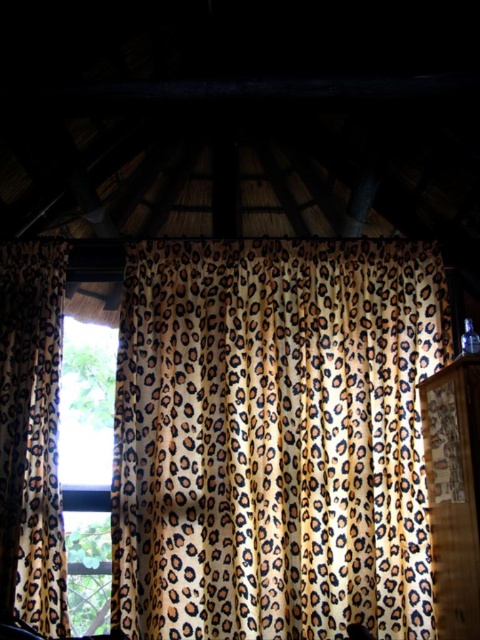
Who is positioned more to the left, leopard print fabric curtain at left or transparent glass window at left?

leopard print fabric curtain at left is more to the left.

Does leopard print fabric curtain at left appear under transparent glass window at left?

No, leopard print fabric curtain at left is not below transparent glass window at left.

Does point (9, 417) come closer to viewer compared to point (106, 579)?

Yes, it is in front of point (106, 579).

The height and width of the screenshot is (640, 480). Find the location of `leopard print fabric curtain at left`. leopard print fabric curtain at left is located at coordinates (32, 435).

Is leopard print fabric at center positioned behind transparent glass window at left?

No, it is not.

Is point (164, 470) behind point (97, 500)?

No, it is not.

Between point (298, 300) and point (109, 586), which one is positioned behind?

Point (109, 586)

Identify the location of leopard print fabric at center. click(274, 438).

How far apart are leopard print fabric at center and leopard print fabric curtain at left?

They are 3.32 feet apart.

Which is in front, point (238, 348) or point (21, 276)?

Point (238, 348) is in front.

At what (x,y) coordinates should I click in order to perform the action: click on leopard print fabric at center. Please return your answer as a coordinate pair (x, y). This screenshot has width=480, height=640. Looking at the image, I should click on (274, 438).